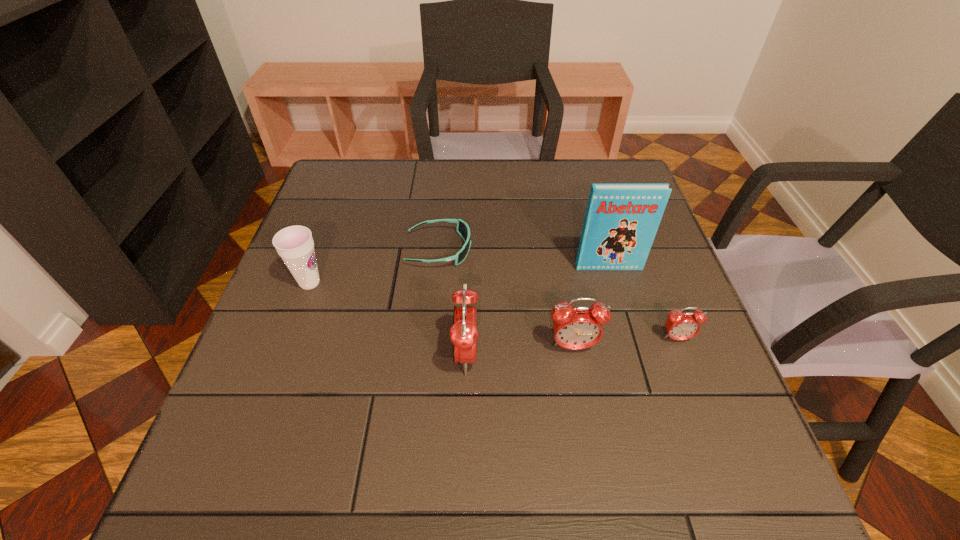
Image resolution: width=960 pixels, height=540 pixels. I want to click on free point located 0.390m on the front-facing side of the shortest object, so click(627, 249).

This screenshot has width=960, height=540. What are the coordinates of `vacant space located on the back of the leftmost object` in the screenshot? It's located at (346, 184).

Find the location of `vacant space situated on the front cover of the book`. vacant space situated on the front cover of the book is located at coordinates (618, 299).

Identify the location of object present at the left edge. This screenshot has width=960, height=540. (295, 245).

Where is `alarm clock at the right edge`? The image size is (960, 540). alarm clock at the right edge is located at coordinates (680, 326).

The height and width of the screenshot is (540, 960). Identify the location of book present at the right edge. point(621,221).

Identify the location of free space at the far edge of the desktop. (549, 200).

The image size is (960, 540). In order to click on vacant space at the left edge in this screenshot , I will do `click(283, 309)`.

In the image, there is a desktop. Identify the location of vacant space at the right edge. The height and width of the screenshot is (540, 960). (615, 293).

Where is `free space at the far right corner of the desktop`? The width and height of the screenshot is (960, 540). free space at the far right corner of the desktop is located at coordinates (587, 195).